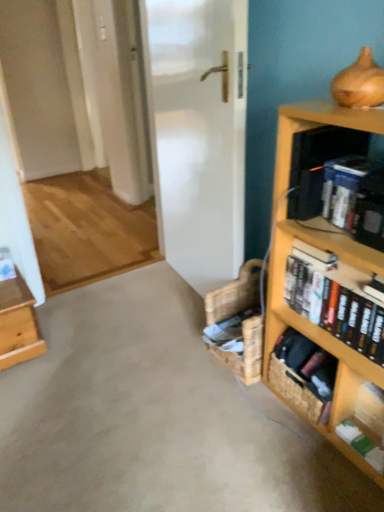
Where is `free space that is in between light brown wooden table at left and green matte book at lower right, which is the 1th book in bottom-to-top order`? free space that is in between light brown wooden table at left and green matte book at lower right, which is the 1th book in bottom-to-top order is located at coordinates click(x=155, y=383).